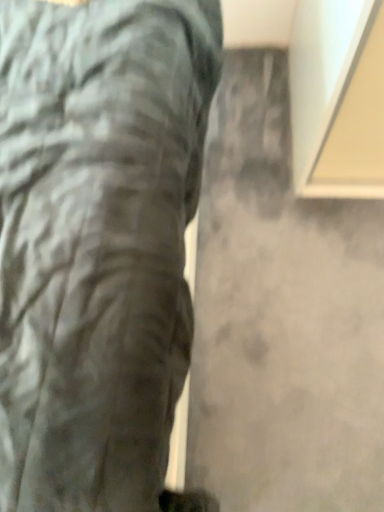
Question: From the image's perspective, is matte gray trousers at center on gray matte concrete at center?

Choices:
 (A) yes
 (B) no

Answer: (A)

Question: Does matte gray trousers at center have a greater height compared to gray matte concrete at center?

Choices:
 (A) yes
 (B) no

Answer: (A)

Question: Can you confirm if matte gray trousers at center is positioned to the right of gray matte concrete at center?

Choices:
 (A) yes
 (B) no

Answer: (B)

Question: Could you tell me if matte gray trousers at center is facing gray matte concrete at center?

Choices:
 (A) yes
 (B) no

Answer: (A)

Question: From a real-world perspective, is matte gray trousers at center physically below gray matte concrete at center?

Choices:
 (A) yes
 (B) no

Answer: (B)

Question: Can you confirm if matte gray trousers at center is shorter than gray matte concrete at center?

Choices:
 (A) yes
 (B) no

Answer: (B)

Question: Is gray matte concrete at center taller than matte gray trousers at center?

Choices:
 (A) no
 (B) yes

Answer: (A)

Question: Is gray matte concrete at center surrounding matte gray trousers at center?

Choices:
 (A) no
 (B) yes

Answer: (A)

Question: Does gray matte concrete at center turn towards matte gray trousers at center?

Choices:
 (A) yes
 (B) no

Answer: (B)

Question: Is gray matte concrete at center far from matte gray trousers at center?

Choices:
 (A) no
 (B) yes

Answer: (A)

Question: Does gray matte concrete at center have a greater width compared to matte gray trousers at center?

Choices:
 (A) no
 (B) yes

Answer: (A)

Question: Is gray matte concrete at center closer to camera compared to matte gray trousers at center?

Choices:
 (A) no
 (B) yes

Answer: (A)

Question: In terms of width, does gray matte concrete at center look wider or thinner when compared to matte gray trousers at center?

Choices:
 (A) thin
 (B) wide

Answer: (A)